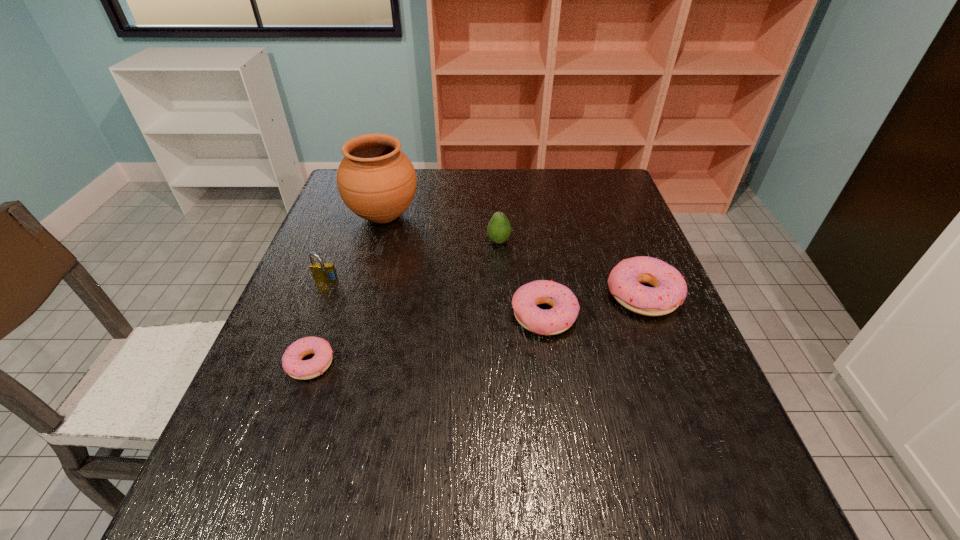
Please determine a free point for an extra doughnut to ensure balance. Please provide its 2D coordinates. Your answer should be formatted as a tuple, i.e. [(x, y)], where the tuple contains the x and y coordinates of a point satisfying the conditions above.

[(433, 339)]